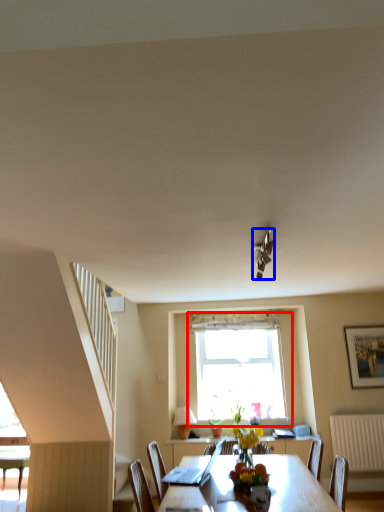
Question: Which object is closer to the camera taking this photo, window (highlighted by a red box) or light fixture (highlighted by a blue box)?

Choices:
 (A) window
 (B) light fixture

Answer: (B)